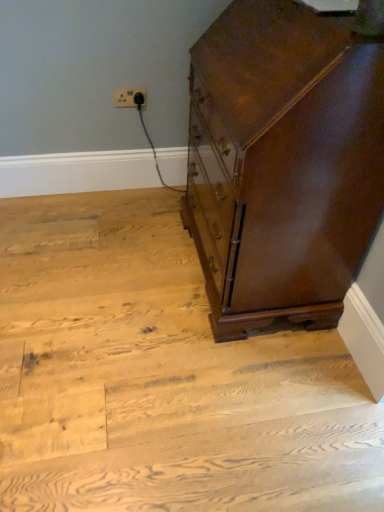
At what (x,y) coordinates should I click in order to perform the action: click on free space to the left of shiny brown wood chest of drawers at right. Please return your answer as a coordinate pair (x, y). The height and width of the screenshot is (512, 384). Looking at the image, I should click on (108, 269).